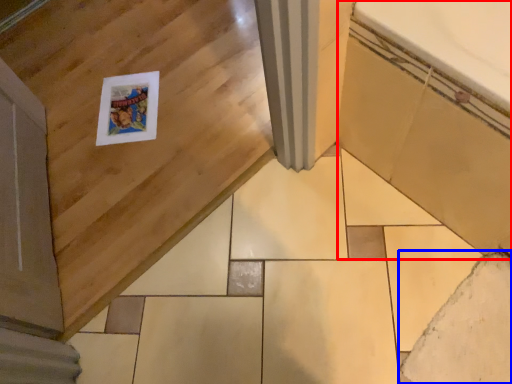
Question: Which of the following is the farthest to the observer, bath (highlighted by a red box) or ceramic tile (highlighted by a blue box)?

Choices:
 (A) bath
 (B) ceramic tile

Answer: (B)